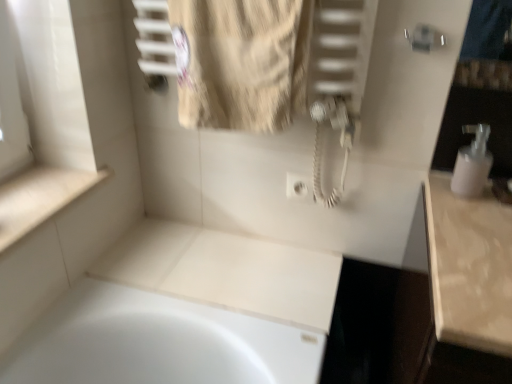
Question: From the image's perspective, is white glossy counter top at lower left located above or below beige textured towel at upper center?

Choices:
 (A) above
 (B) below

Answer: (B)

Question: Is white glossy counter top at lower left in front of or behind beige textured towel at upper center in the image?

Choices:
 (A) front
 (B) behind

Answer: (B)

Question: Which is farther from the beige textured towel at upper center?

Choices:
 (A) white glossy counter top at lower left
 (B) white plastic soap dispenser at right

Answer: (B)

Question: Which object is positioned closest to the beige textured towel at upper center?

Choices:
 (A) white plastic soap dispenser at right
 (B) white glossy counter top at lower left

Answer: (B)